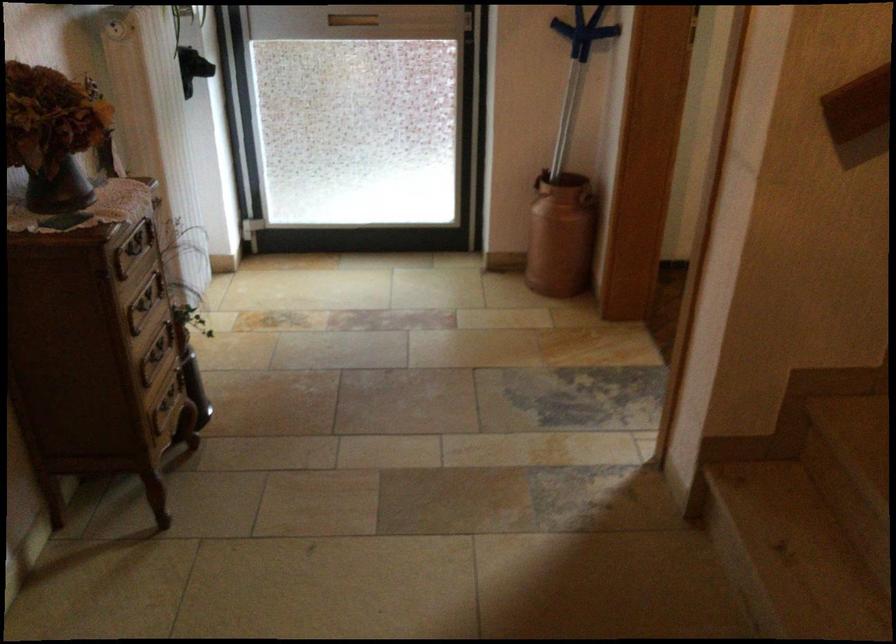
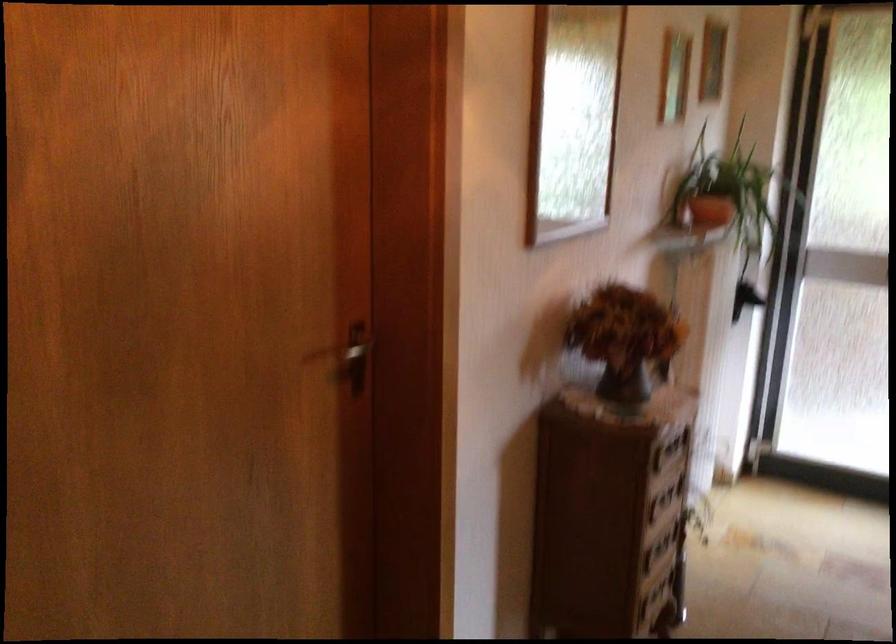
Question: The camera is either moving clockwise (left) or counter-clockwise (right) around the object. The first image is from the beginning of the video and the second image is from the end. Is the camera moving left or right when shooting the video?

Choices:
 (A) Left
 (B) Right

Answer: (B)